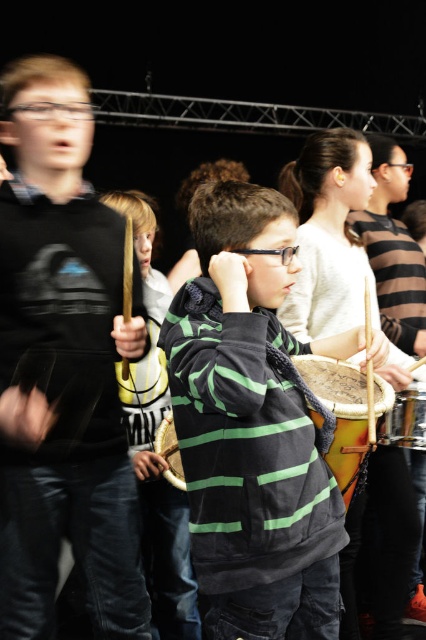
You are a photographer trying to capture the best angle of the drumming activity. You notice two points in the scene labeled as point (267, 228) and point (411, 387). Which point is closer to your camera lens?

Point (267, 228) is closer to the viewer than point (411, 387), so the photographer should focus on point (267, 228) for a closer shot.

You are a photographer standing at the origin point in the image. You want to take a photo of the green striped hoodie at center. Which direction should you move to get the best shot?

The green striped hoodie at center is located at point (252, 428), so you should move to the right and slightly forward to align with the hoodie.